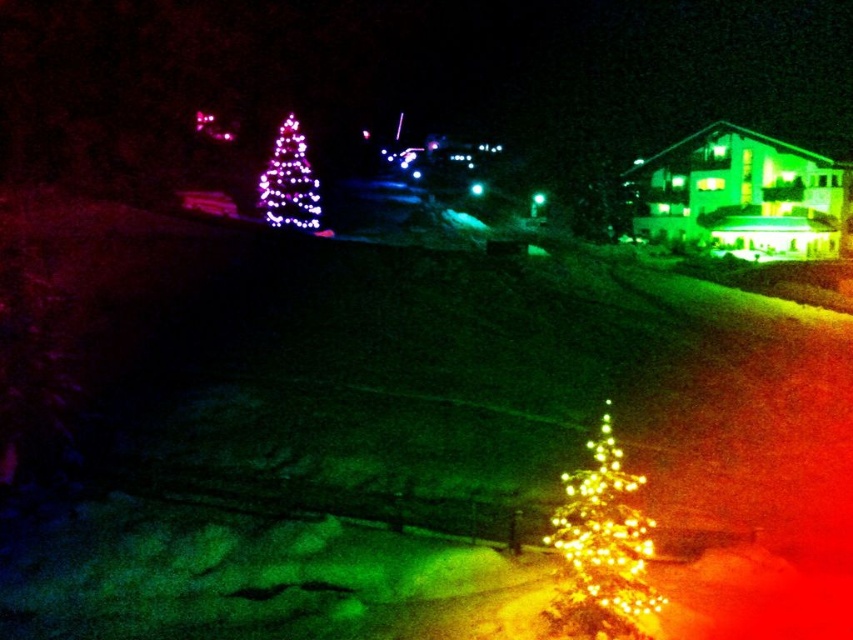
Looking at this image, you are standing in the snowy area and want to take a photo of both the illuminated plastic christmas tree at lower right and the illuminated plastic christmas tree at upper left. Which tree should you position yourself closer to in order to capture both in the same frame?

You should position yourself closer to the illuminated plastic christmas tree at upper left because the illuminated plastic christmas tree at lower right is positioned on the right side of it, allowing both trees to be included in the frame when closer to the upper left tree.

You are standing in the snowy area and want to place a new decoration between the illuminated plastic christmas tree at lower right and the illuminated plastic christmas tree at upper left. Considering their sizes, which tree should the decoration be closer to?

The decoration should be closer to the illuminated plastic christmas tree at upper left because it is larger in size compared to the illuminated plastic christmas tree at lower right.

You are standing in the snowy area and want to take a photo of both the illuminated plastic christmas tree at lower right and the illuminated plastic christmas tree at upper left. Which tree should you position closer to the camera to ensure both are visible in the frame?

You should position the illuminated plastic christmas tree at lower right closer to the camera because it is in front of the illuminated plastic christmas tree at upper left, allowing both to be visible in the frame.